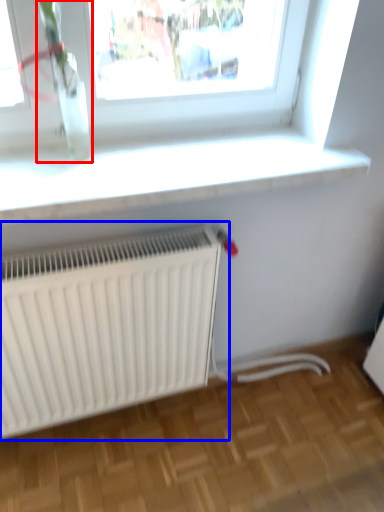
Question: Which point is closer to the camera, plant (highlighted by a red box) or radiator (highlighted by a blue box)?

Choices:
 (A) plant
 (B) radiator

Answer: (A)